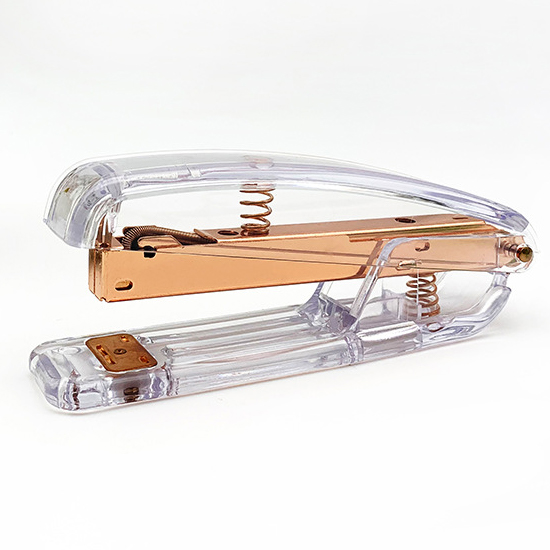
Find the location of a particular element. The width and height of the screenshot is (550, 550). documents is located at coordinates (x=214, y=194), (x=176, y=255), (x=133, y=412).